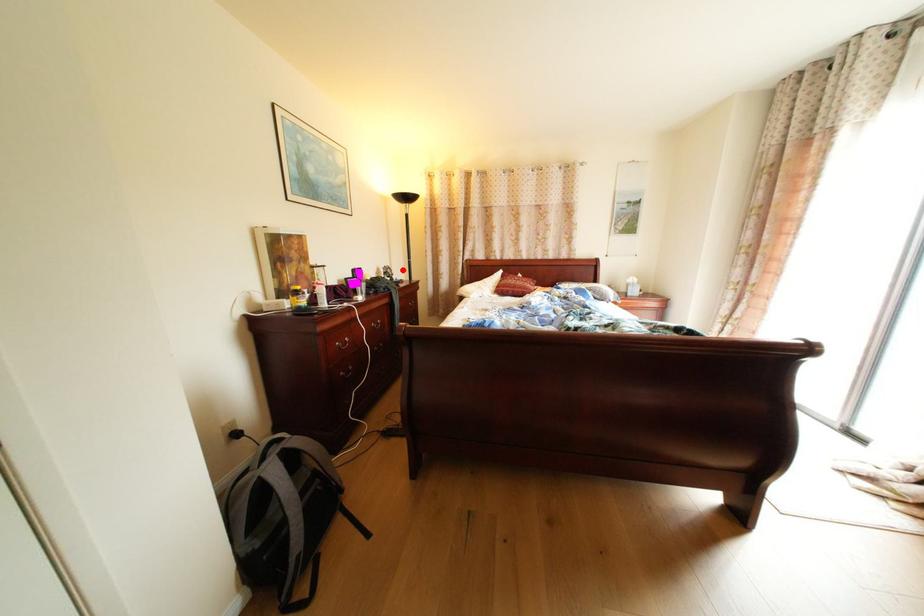
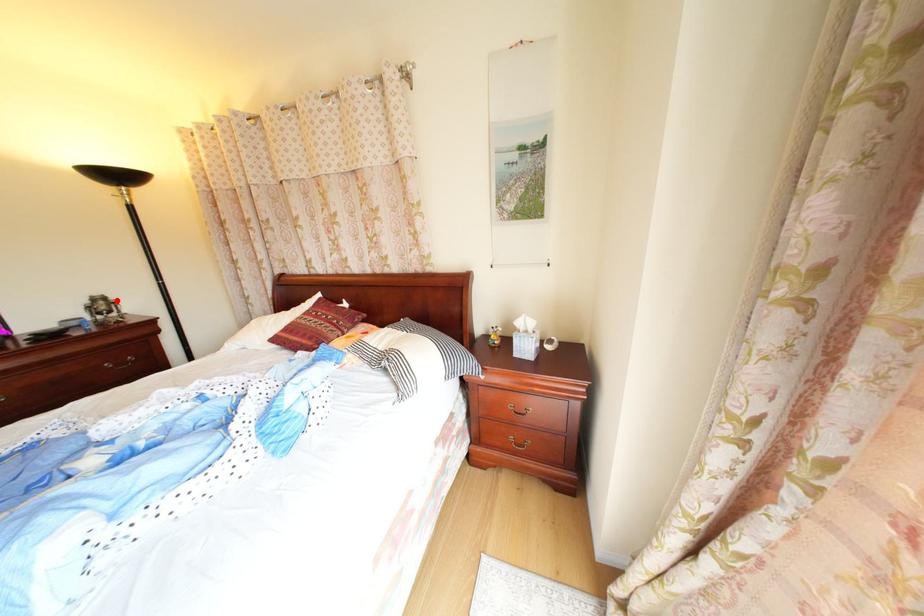
I am providing you with two images of the same scene from different viewpoints. A red point is marked on the first image and another point is marked on the second image. Do the highlighted points in image1 and image2 indicate the same real-world spot?

Yes